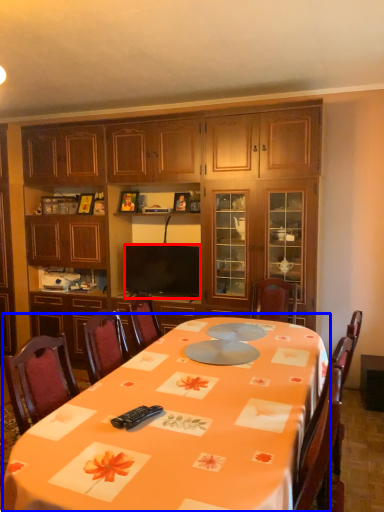
Question: Which object appears farthest to the camera in this image, television (highlighted by a red box) or round table (highlighted by a blue box)?

Choices:
 (A) television
 (B) round table

Answer: (A)